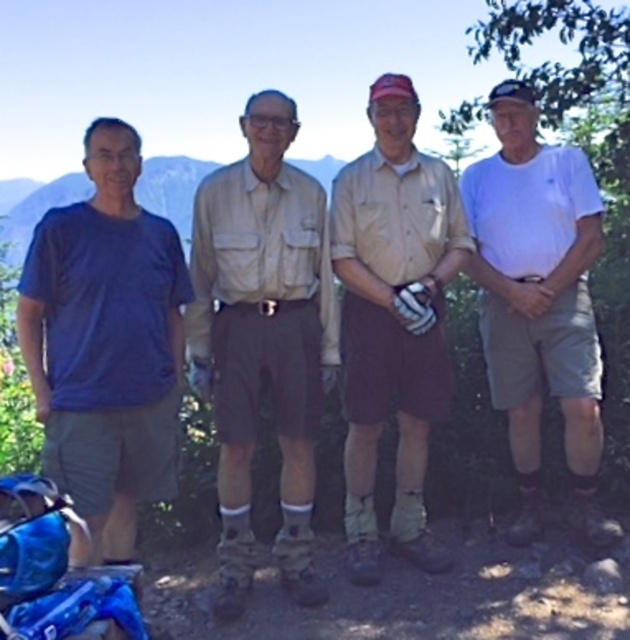
Is tan/cotton shirt at center closer to the viewer compared to white cotton shirt at right?

Yes, tan/cotton shirt at center is closer to the viewer.

How far apart are tan/cotton shirt at center and white cotton shirt at right?

tan/cotton shirt at center and white cotton shirt at right are 22.69 inches apart from each other.

Between point (437, 369) and point (537, 531), which one is positioned in front?

Point (437, 369) is more forward.

At what (x,y) coordinates should I click in order to perform the action: click on tan/cotton shirt at center. Please return your answer as a coordinate pair (x, y). Looking at the image, I should click on (392, 317).

From the picture: Who is lower down, beige fabric shirt at center or white cotton shirt at right?

beige fabric shirt at center is lower down.

Who is positioned more to the right, beige fabric shirt at center or white cotton shirt at right?

white cotton shirt at right is more to the right.

At what (x,y) coordinates should I click in order to perform the action: click on beige fabric shirt at center. Please return your answer as a coordinate pair (x, y). This screenshot has width=630, height=640. Looking at the image, I should click on (261, 339).

Is the position of beige fabric shirt at center less distant than that of white synthetic baseball glove at center?

Yes, beige fabric shirt at center is in front of white synthetic baseball glove at center.

Between beige fabric shirt at center and white synthetic baseball glove at center, which one appears on the left side from the viewer's perspective?

beige fabric shirt at center is more to the left.

Between point (318, 195) and point (403, 307), which one is positioned in front?

Positioned in front is point (403, 307).

This screenshot has height=640, width=630. I want to click on beige fabric shirt at center, so click(261, 339).